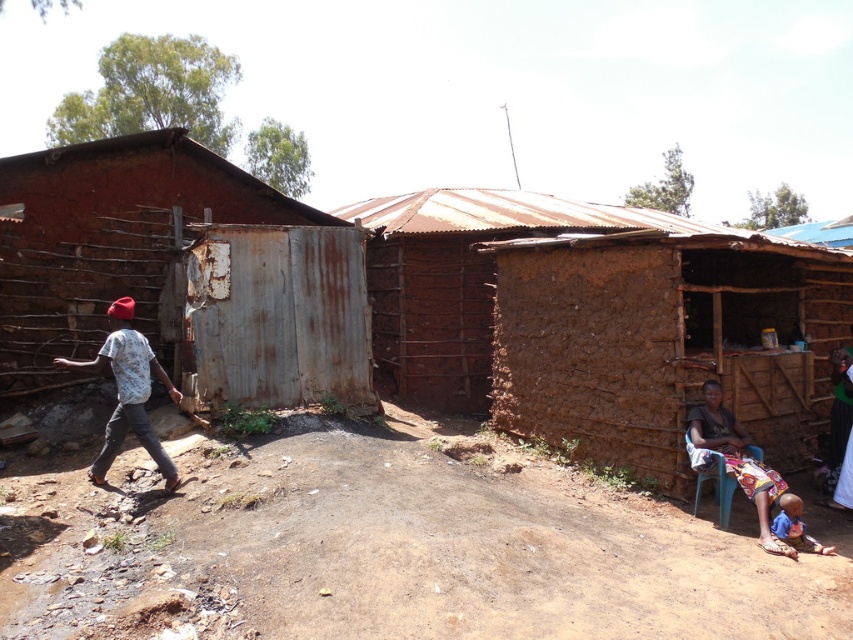
You are standing in the rural area and want to approach both the brown mud hut at right and the white printed shirt at left. Which one will you reach first?

You will reach the brown mud hut at right first because it is closer to you than the white printed shirt at left, which is further away.

Based on the photo, you are a visitor in this rural area and want to take a photo of the brown mud hut at right and the white printed shirt at left. Which object should you zoom in more on to capture both in the frame?

You should zoom in more on the white printed shirt at left because it is smaller than the brown mud hut at right, allowing both to fit in the frame.

Based on the photo, you are planning to install a solar panel on the roof of one of the huts. Considering the height difference between the brown mud hut at right and the rusty metal hut at left, which one would require a ladder of shorter length to reach its roof?

The brown mud hut at right has a lesser height compared to the rusty metal hut at left, so a shorter ladder would be sufficient for the brown mud hut at right.